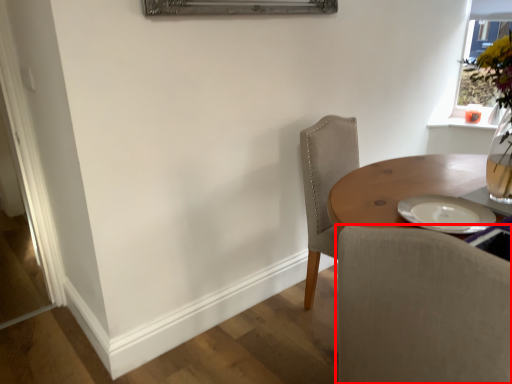
Question: From the image's perspective, considering the relative positions of chair (annotated by the red box) and window in the image provided, where is chair (annotated by the red box) located with respect to the staircase?

Choices:
 (A) below
 (B) above

Answer: (A)